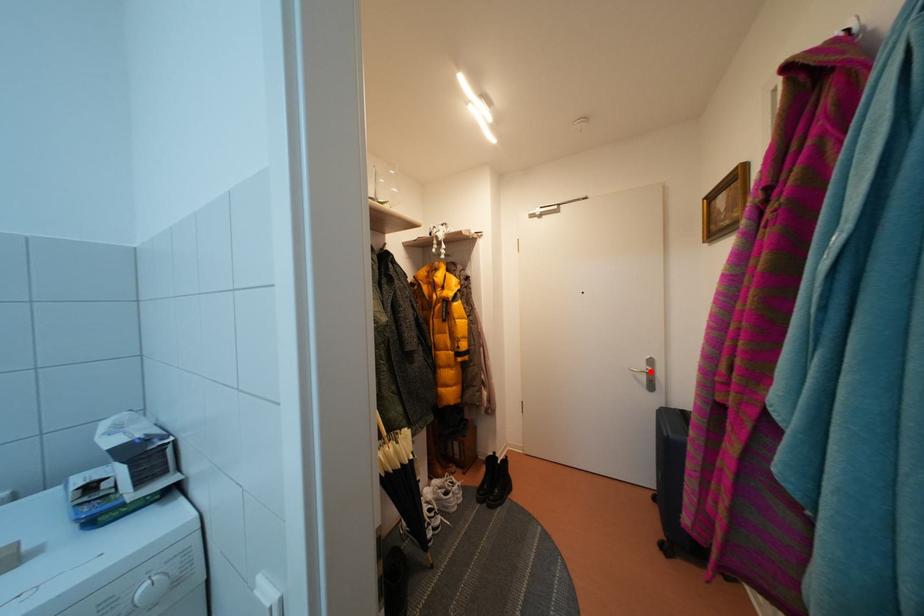
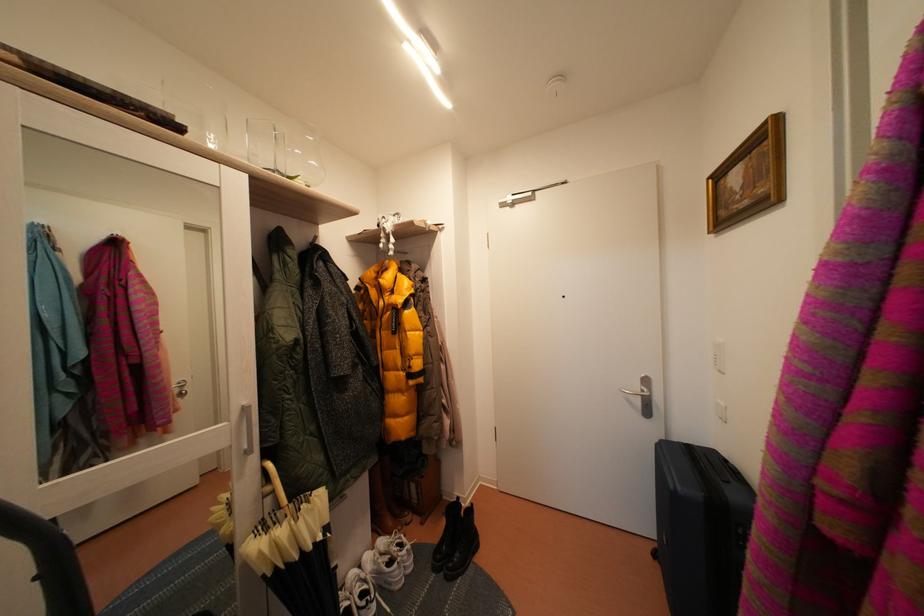
In the second image, find the point that corresponds to the highlighted location in the first image.

(645, 392)